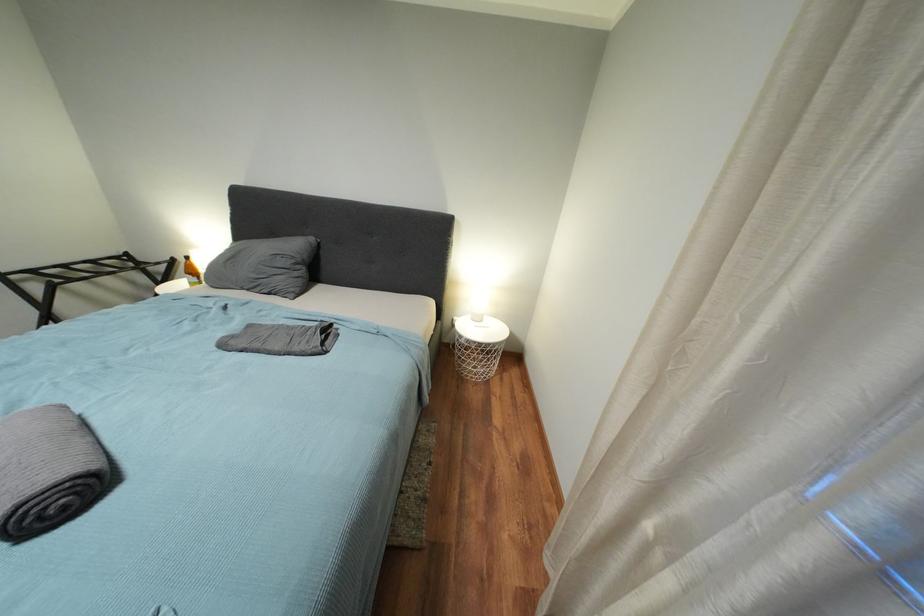
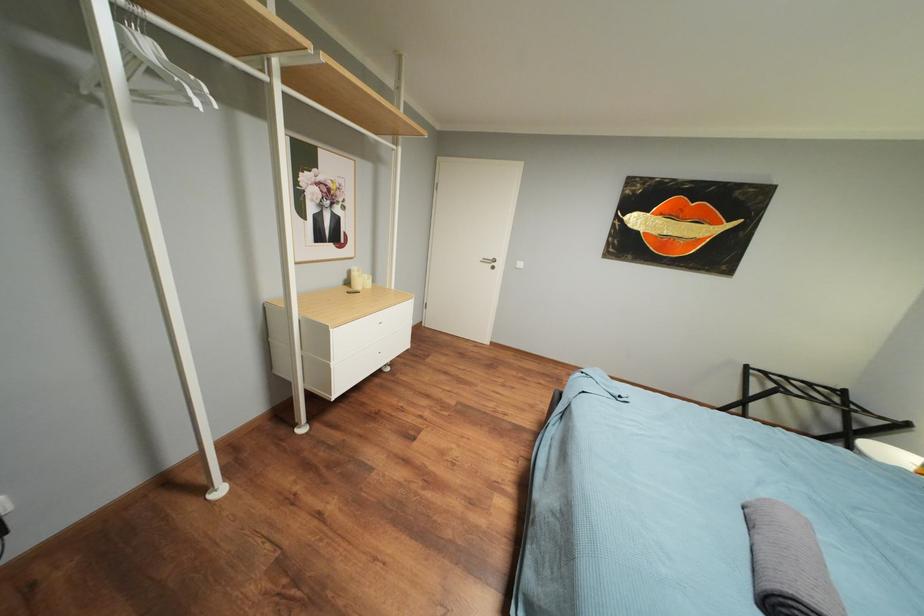
The images are taken continuously from a first-person perspective. In which direction is your viewpoint rotating?

The rotation direction of the camera is left-down.